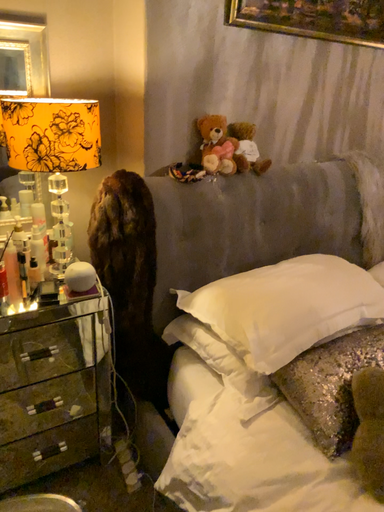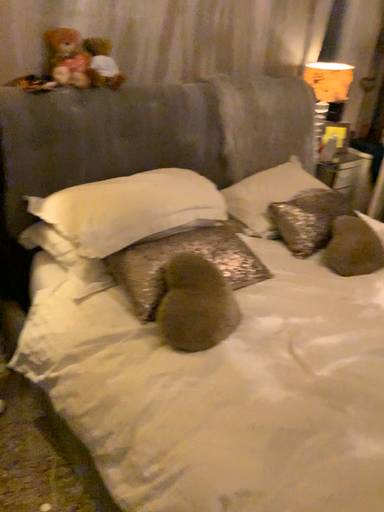
Question: Which way did the camera rotate in the video?

Choices:
 (A) rotated left
 (B) rotated right

Answer: (B)